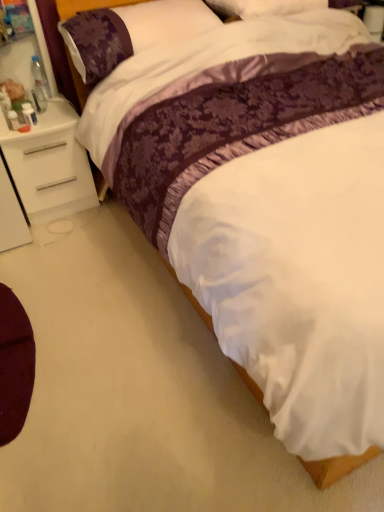
I want to click on free location to the right of plush brown bear at left, so click(56, 112).